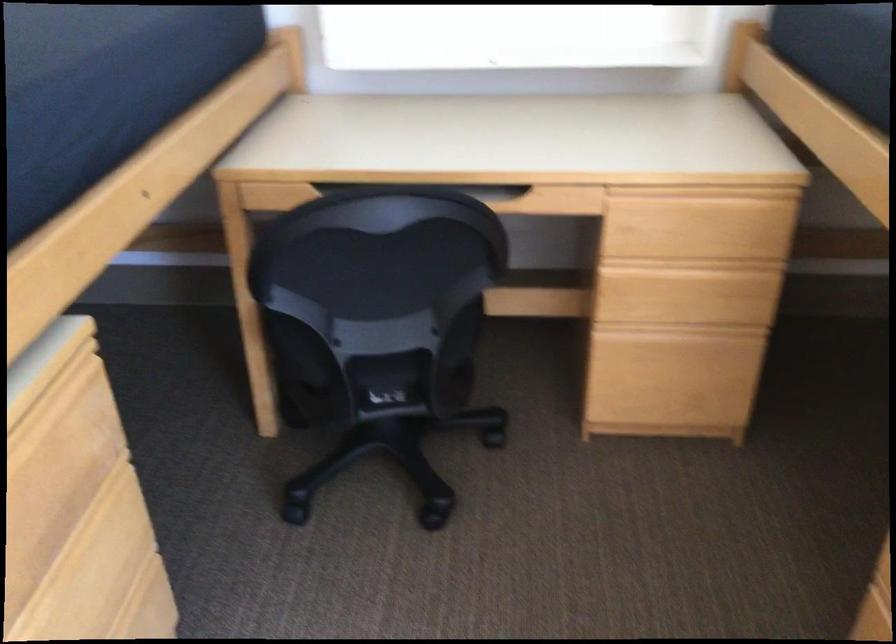
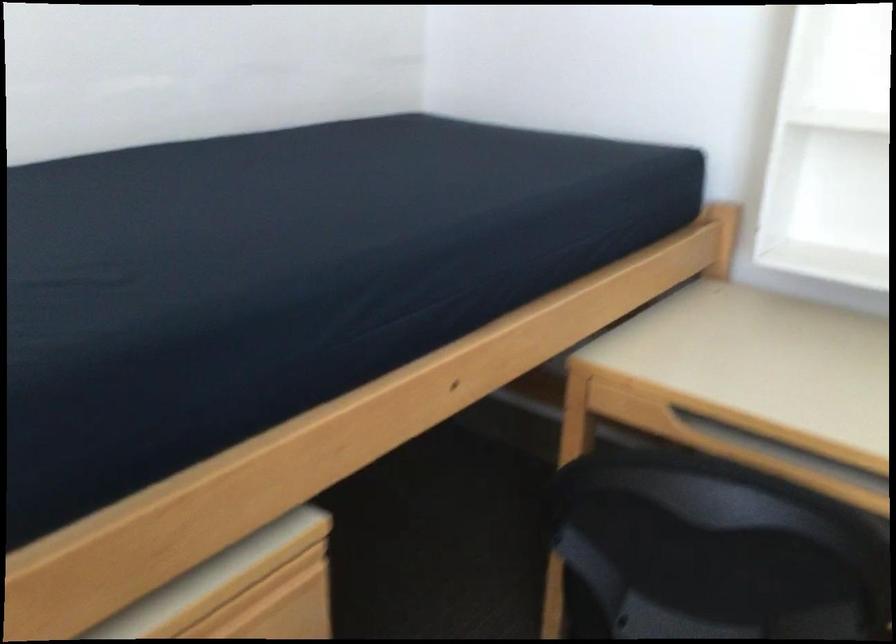
Where in the second image is the point corresponding to pixel 71 384 from the first image?

(277, 581)